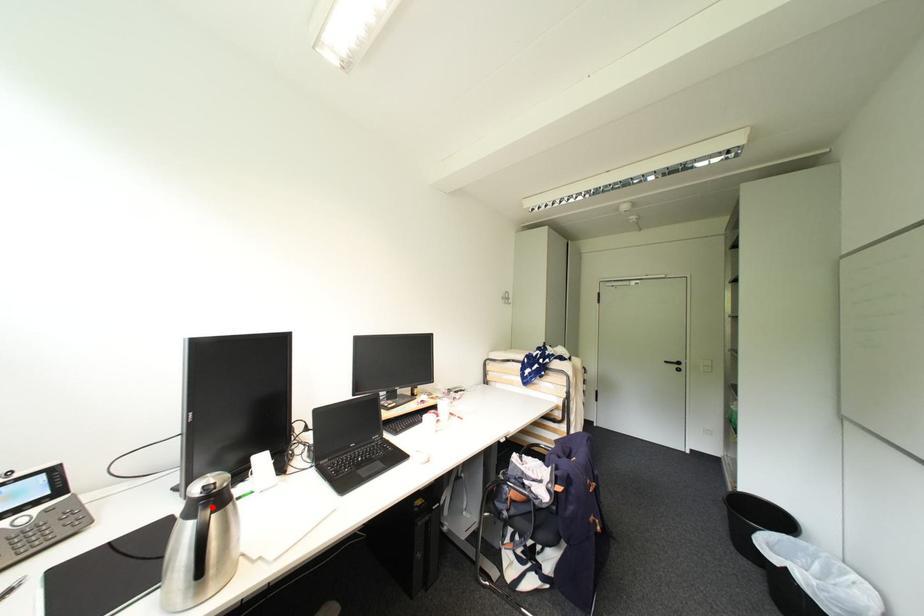
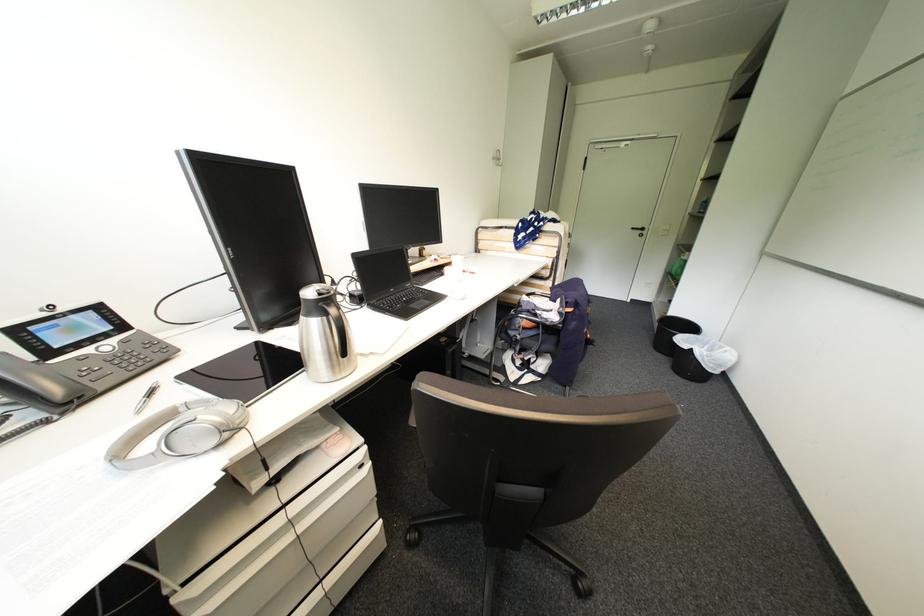
Question: I am providing you with two images of the same scene from different viewpoints. Image1 has a red point marked. In image2, the corresponding 3D location appears at what relative position? Reply with the corresponding letter.

Choices:
 (A) Closer
 (B) Farther

Answer: (A)